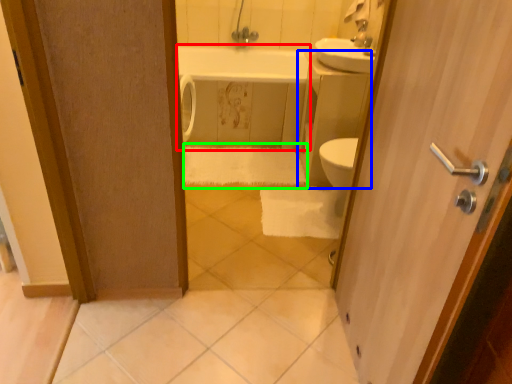
Question: Which object is the farthest from bath (highlighted by a red box)? Choose among these: counter top (highlighted by a blue box) or bath towel (highlighted by a green box).

Choices:
 (A) counter top
 (B) bath towel

Answer: (A)